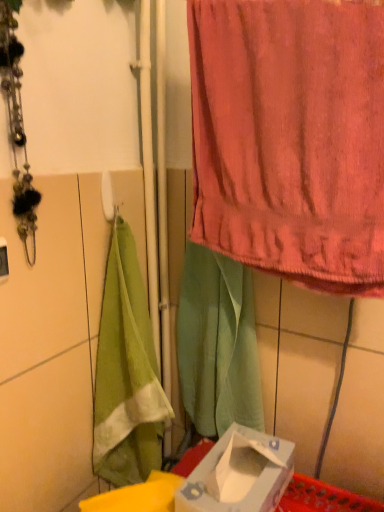
Question: Is green fabric at center wider or thinner than pink terry cloth towel at upper right?

Choices:
 (A) thin
 (B) wide

Answer: (B)

Question: Is green fabric at center inside the boundaries of pink terry cloth towel at upper right, or outside?

Choices:
 (A) inside
 (B) outside

Answer: (B)

Question: Which of these objects is positioned farthest from the pink terry cloth towel at upper right?

Choices:
 (A) green fabric at center
 (B) white cardboard box at lower center

Answer: (B)

Question: Which object is the closest to the pink terry cloth towel at upper right?

Choices:
 (A) green fabric at center
 (B) white cardboard box at lower center

Answer: (A)